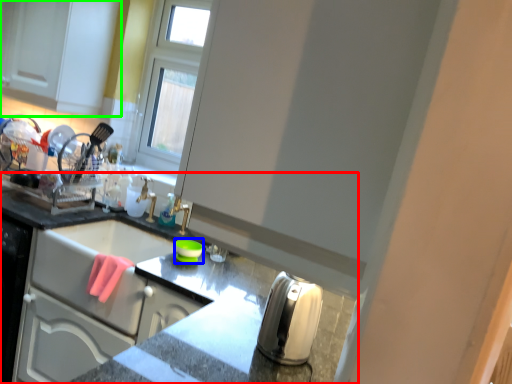
Question: Based on their relative distances, which object is farther from countertop (highlighted by a red box)? Choose from appliance (highlighted by a blue box) and cabinetry (highlighted by a green box).

Choices:
 (A) appliance
 (B) cabinetry

Answer: (B)